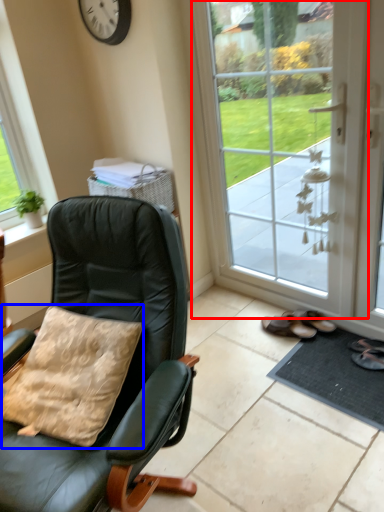
Question: Which object appears closest to the camera in this image, door (highlighted by a red box) or pillow (highlighted by a blue box)?

Choices:
 (A) door
 (B) pillow

Answer: (B)